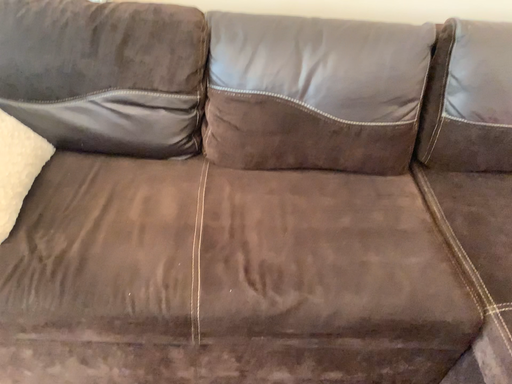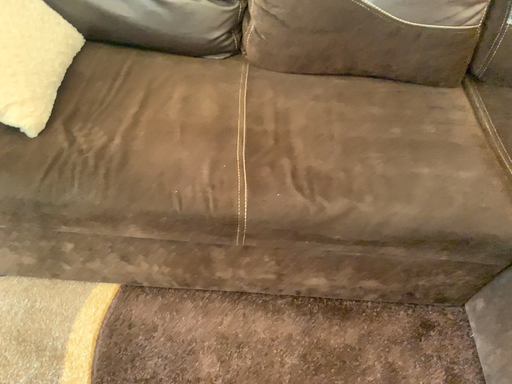
Question: How did the camera likely rotate when shooting the video?

Choices:
 (A) rotated upward
 (B) rotated downward

Answer: (B)